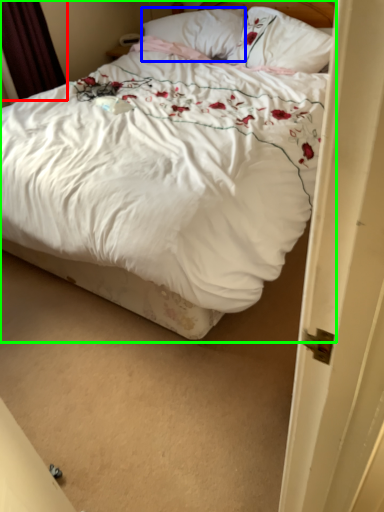
Question: Which object is the farthest from curtain (highlighted by a red box)? Choose among these: pillow (highlighted by a blue box) or bed (highlighted by a green box).

Choices:
 (A) pillow
 (B) bed

Answer: (B)